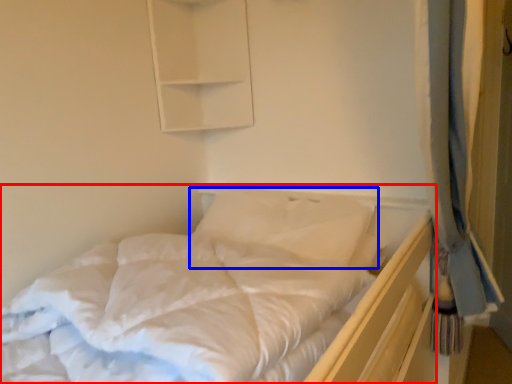
Question: Which point is closer to the camera, bed (highlighted by a red box) or pillow (highlighted by a blue box)?

Choices:
 (A) bed
 (B) pillow

Answer: (A)